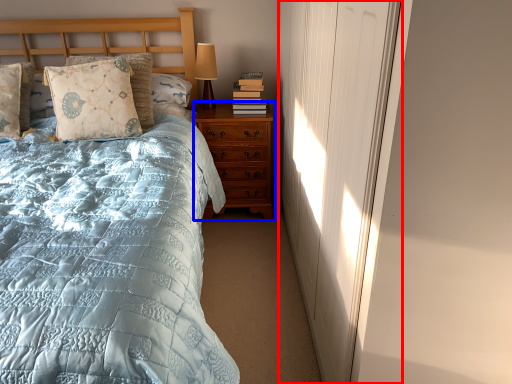
Question: Which point is further to the camera, curtain (highlighted by a red box) or nightstand (highlighted by a blue box)?

Choices:
 (A) curtain
 (B) nightstand

Answer: (B)